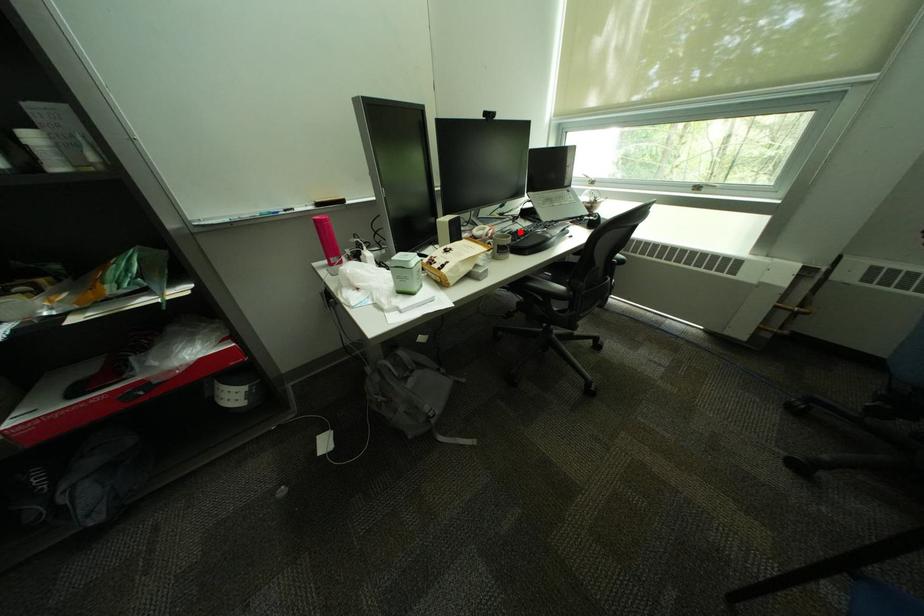
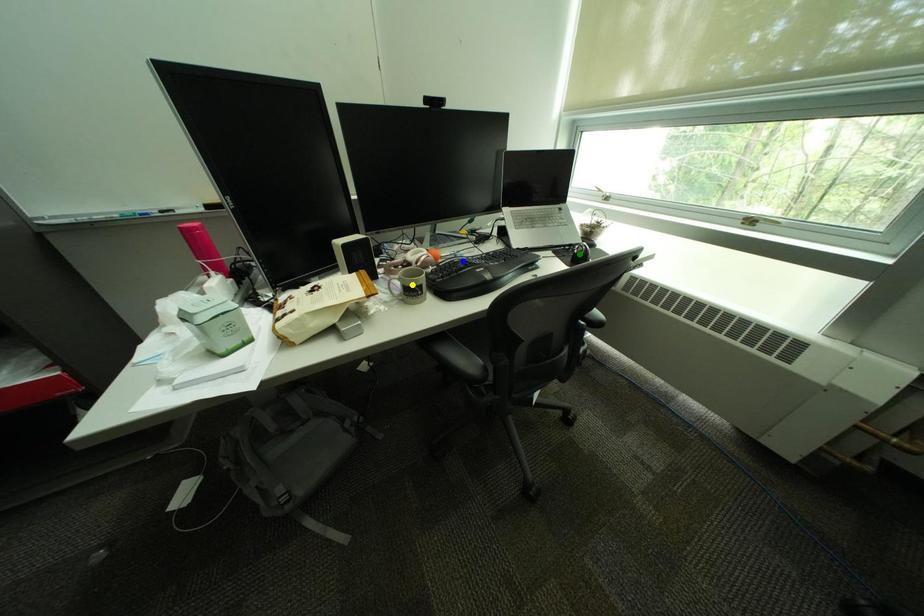
Question: I am providing you with two images of the same scene from different viewpoints. A red point is marked on the first image. You are given multiple points on the second image. Which point in image 2 is actually the same real-world point as the red point in image 1?

Choices:
 (A) green point
 (B) yellow point
 (C) blue point

Answer: (C)